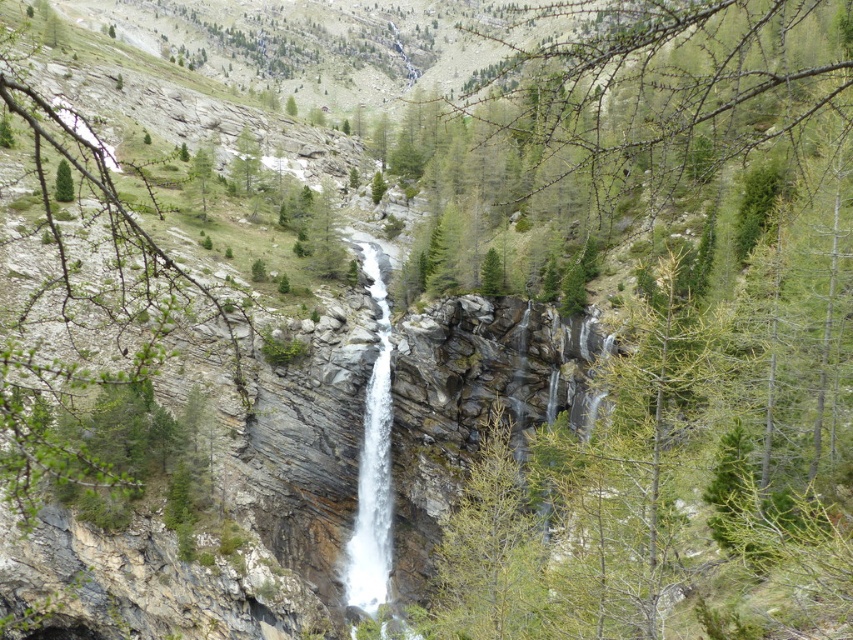
Question: Does green leafy branch at center have a lesser width compared to green matte tree at upper left?

Choices:
 (A) no
 (B) yes

Answer: (A)

Question: Does green leafy branch at center appear under green matte tree at upper left?

Choices:
 (A) yes
 (B) no

Answer: (A)

Question: Which of the following is the farthest from the observer?

Choices:
 (A) green leafy branch at center
 (B) white smooth waterfall at center

Answer: (B)

Question: Which of these objects is positioned farthest from the green matte tree at upper left?

Choices:
 (A) green leafy branch at center
 (B) white smooth waterfall at center

Answer: (B)

Question: Is white smooth waterfall at center bigger than green matte tree at upper left?

Choices:
 (A) yes
 (B) no

Answer: (A)

Question: Which point appears farthest from the camera in this image?

Choices:
 (A) (364, 545)
 (B) (62, 182)

Answer: (B)